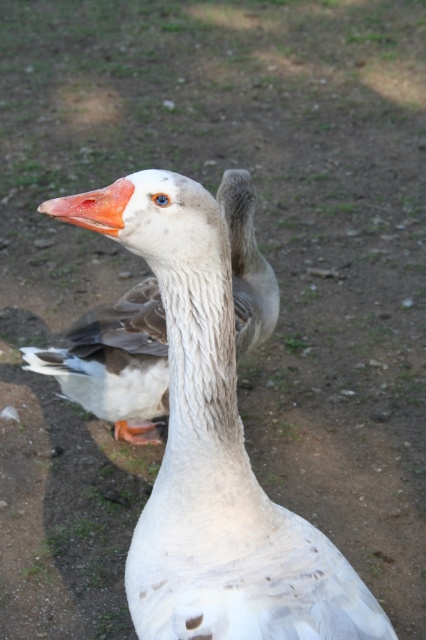
Can you confirm if white feathered duck at center is positioned below orange matte beak at center?

Yes, white feathered duck at center is below orange matte beak at center.

Who is lower down, white feathered duck at center or orange matte beak at center?

white feathered duck at center

You are a GUI agent. You are given a task and a screenshot of the screen. Output one action in this format:
    pyautogui.click(x=<x>, y=<y>)
    Task: Click on the white feathered duck at center
    
    Given the screenshot: What is the action you would take?
    pyautogui.click(x=219, y=464)

Identify the location of white feathered duck at center. This screenshot has height=640, width=426. (219, 464).

Is white feathered goose at center thinner than orange matte beak at center?

No, white feathered goose at center is not thinner than orange matte beak at center.

Consider the image. Is the position of white feathered goose at center less distant than that of orange matte beak at center?

That is False.

Which is in front, point (106, 342) or point (46, 208)?

Point (46, 208)

The height and width of the screenshot is (640, 426). Identify the location of white feathered goose at center. (115, 364).

Can you confirm if white feathered duck at center is wider than white feathered goose at center?

Incorrect, white feathered duck at center's width does not surpass white feathered goose at center's.

This screenshot has height=640, width=426. I want to click on white feathered duck at center, so click(219, 464).

In order to click on white feathered duck at center in this screenshot , I will do `click(219, 464)`.

I want to click on white feathered duck at center, so click(219, 464).